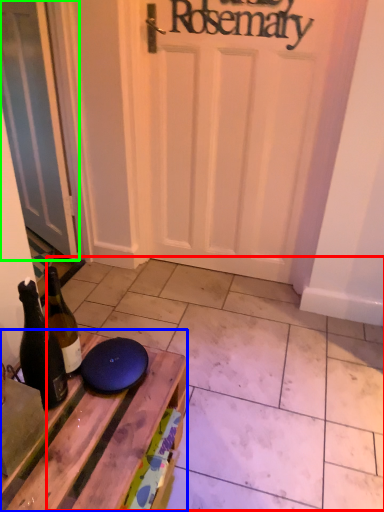
Question: Considering the real-world distances, which object is farthest from tile (highlighted by a red box)? table (highlighted by a blue box) or door (highlighted by a green box)?

Choices:
 (A) table
 (B) door

Answer: (B)